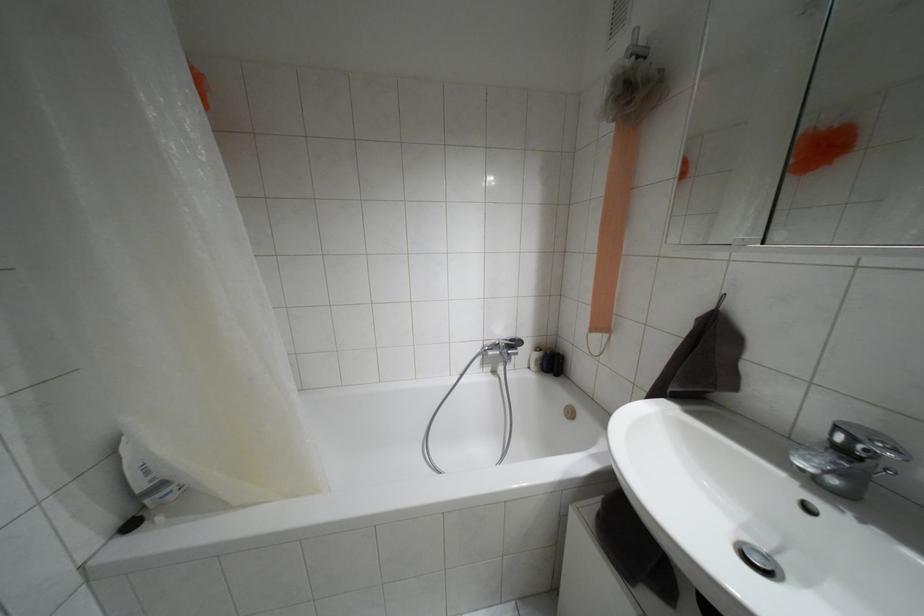
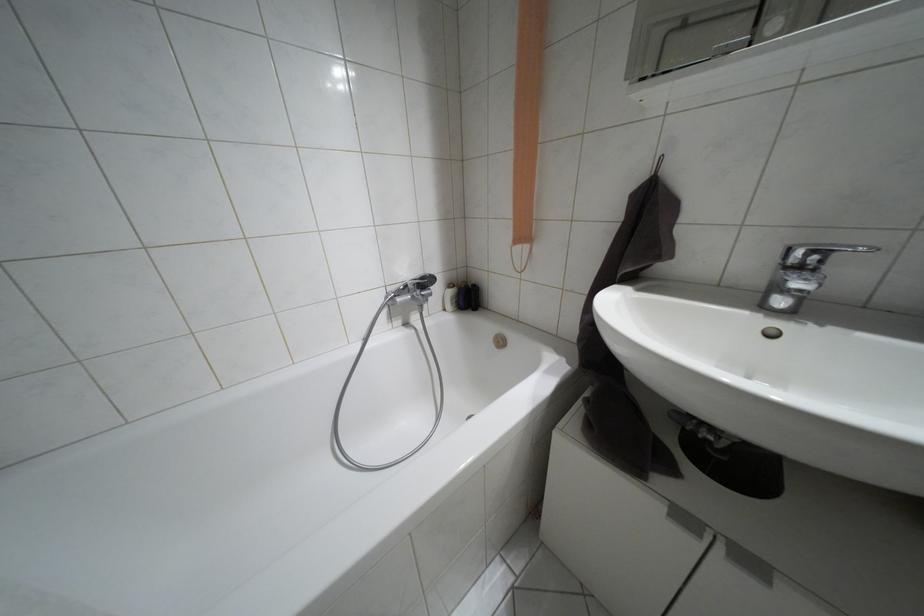
Locate, in the second image, the point that corresponds to the point at 537,347 in the first image.

(448, 285)